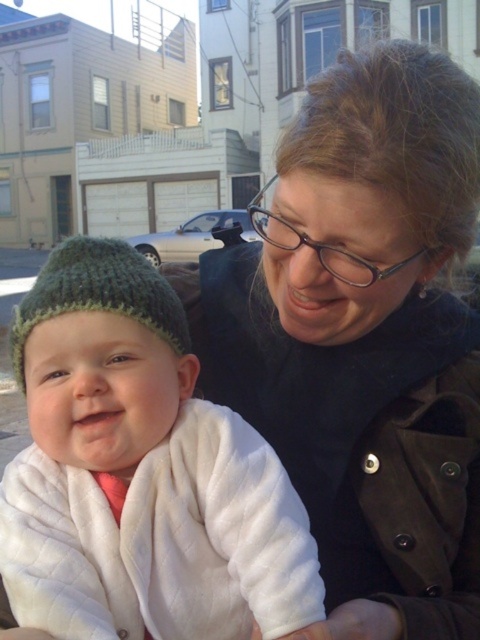
Can you confirm if matte black jacket at center is bigger than knitted green hat at left?

Yes, matte black jacket at center is bigger than knitted green hat at left.

Measure the distance between point (x=290, y=426) and camera.

A distance of 1.03 meters exists between point (x=290, y=426) and camera.

You are a GUI agent. You are given a task and a screenshot of the screen. Output one action in this format:
    pyautogui.click(x=<x>, y=<y>)
    Task: Click on the matte black jacket at center
    This screenshot has width=480, height=640.
    Given the screenshot: What is the action you would take?
    pyautogui.click(x=363, y=337)

Can you confirm if knitted green hat at left is taller than green knitted hat at left?

→ Correct, knitted green hat at left is much taller as green knitted hat at left.

I want to click on knitted green hat at left, so click(x=101, y=356).

Can you confirm if matte black jacket at center is positioned below green knitted hat at left?

Yes, matte black jacket at center is below green knitted hat at left.

Who is more forward, (384,54) or (62,253)?

Point (384,54)

At what (x,y) coordinates should I click in order to perform the action: click on matte black jacket at center. Please return your answer as a coordinate pair (x, y). The image size is (480, 640). Looking at the image, I should click on (363, 337).